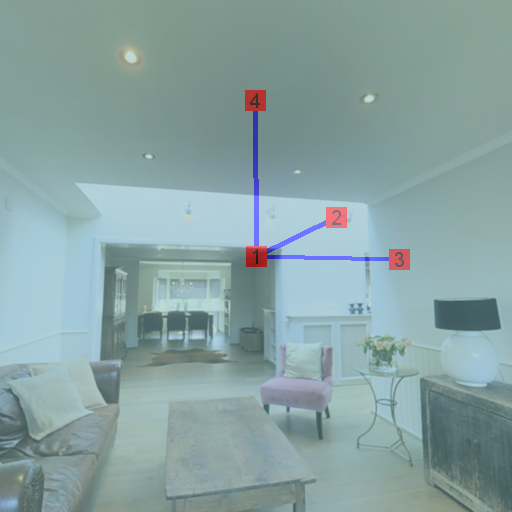
Identify the location of chair. (318, 396).